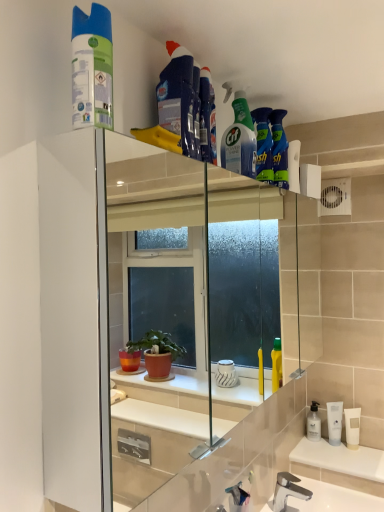
This screenshot has height=512, width=384. In order to click on blue glossy bottle at upper center, the 5th cleaning product when ordered from left to right in this screenshot , I will do tap(263, 145).

Describe the element at coordinates (207, 118) in the screenshot. The image size is (384, 512). I see `blue fabric cleaning product at upper center, which ranks as the third cleaning product in front-to-back order` at that location.

Describe the element at coordinates (288, 490) in the screenshot. The width and height of the screenshot is (384, 512). I see `polished chrome faucet at lower center` at that location.

Locate an element on the screen. polished chrome faucet at lower center is located at coordinates (288, 490).

What is the approximate height of green matte spray bottle at upper center, the 2th cleaning product positioned from the right?

11.73 inches.

Image resolution: width=384 pixels, height=512 pixels. What do you see at coordinates (92, 68) in the screenshot?
I see `green matte spray can at upper left, arranged as the 5th cleaning product when viewed from the right` at bounding box center [92, 68].

Image resolution: width=384 pixels, height=512 pixels. Describe the element at coordinates (177, 96) in the screenshot. I see `blue fabric cleaning product at upper center, which ranks as the 2th cleaning product in front-to-back order` at that location.

Locate an element on the screen. This screenshot has height=512, width=384. blue glossy bottle at upper center, which is the fifth cleaning product from front to back is located at coordinates (263, 145).

Looking at this image, are green matte spray can at upper left, positioned as the 1th cleaning product in front-to-back order, and blue fabric cleaning product at upper center, which ranks as the 2th cleaning product in front-to-back order, far apart?

No, there isn't a large distance between green matte spray can at upper left, positioned as the 1th cleaning product in front-to-back order, and blue fabric cleaning product at upper center, which ranks as the 2th cleaning product in front-to-back order.

Which of these two, green matte spray can at upper left, positioned as the 1th cleaning product in front-to-back order, or blue fabric cleaning product at upper center, which appears as the fourth cleaning product when viewed from the back, is wider?

Wider between the two is blue fabric cleaning product at upper center, which appears as the fourth cleaning product when viewed from the back.

Between green matte spray can at upper left, arranged as the 5th cleaning product when viewed from the right, and blue fabric cleaning product at upper center, marked as the 4th cleaning product in a right-to-left arrangement, which one has less height?

Standing shorter between the two is green matte spray can at upper left, arranged as the 5th cleaning product when viewed from the right.

Which is behind, blue fabric cleaning product at upper center, which appears as the third cleaning product when viewed from the back, or green matte spray bottle at upper center, the 2th cleaning product positioned from the right?

green matte spray bottle at upper center, the 2th cleaning product positioned from the right, is more distant.

Is blue fabric cleaning product at upper center, which is the third cleaning product from left to right, taller than green matte spray bottle at upper center, acting as the fourth cleaning product starting from the front?

No, blue fabric cleaning product at upper center, which is the third cleaning product from left to right, is not taller than green matte spray bottle at upper center, acting as the fourth cleaning product starting from the front.

How many degrees apart are the facing directions of blue fabric cleaning product at upper center, which is counted as the 3th cleaning product, starting from the right, and green matte spray bottle at upper center, positioned as the fourth cleaning product in left-to-right order?

The facing directions of blue fabric cleaning product at upper center, which is counted as the 3th cleaning product, starting from the right, and green matte spray bottle at upper center, positioned as the fourth cleaning product in left-to-right order, are 20.9 degrees apart.

In terms of size, does blue fabric cleaning product at upper center, which appears as the third cleaning product when viewed from the back, appear bigger or smaller than green matte spray bottle at upper center, positioned as the fourth cleaning product in left-to-right order?

In the image, blue fabric cleaning product at upper center, which appears as the third cleaning product when viewed from the back, appears to be smaller than green matte spray bottle at upper center, positioned as the fourth cleaning product in left-to-right order.

I want to click on cleaning product that is the 2nd one when counting leftward from the blue glossy bottle at upper center, which is the fifth cleaning product from front to back, so click(207, 118).

Does blue fabric cleaning product at upper center, which is counted as the 3th cleaning product, starting from the right, turn towards blue glossy bottle at upper center, the first cleaning product positioned from the back?

No, blue fabric cleaning product at upper center, which is counted as the 3th cleaning product, starting from the right, does not turn towards blue glossy bottle at upper center, the first cleaning product positioned from the back.

From the image's perspective, is blue fabric cleaning product at upper center, which is the third cleaning product from left to right, positioned above or below blue glossy bottle at upper center, marked as the first cleaning product in a right-to-left arrangement?

From the image's perspective, blue fabric cleaning product at upper center, which is the third cleaning product from left to right, appears above blue glossy bottle at upper center, marked as the first cleaning product in a right-to-left arrangement.

Which object is wider, blue fabric cleaning product at upper center, which is the third cleaning product from left to right, or blue glossy bottle at upper center, marked as the first cleaning product in a right-to-left arrangement?

blue glossy bottle at upper center, marked as the first cleaning product in a right-to-left arrangement.

Image resolution: width=384 pixels, height=512 pixels. I want to click on tap below the green matte spray can at upper left, arranged as the 5th cleaning product when viewed from the right (from the image's perspective), so click(288, 490).

Does point (79, 9) come closer to viewer compared to point (284, 500)?

Yes, point (79, 9) is in front of point (284, 500).

Is green matte spray can at upper left, marked as the 5th cleaning product in a back-to-front arrangement, in contact with polished chrome faucet at lower center?

No.

Who is smaller, green matte spray can at upper left, placed as the 1th cleaning product when sorted from left to right, or blue fabric cleaning product at upper center, which is counted as the 3th cleaning product, starting from the right?

With smaller size is blue fabric cleaning product at upper center, which is counted as the 3th cleaning product, starting from the right.

Considering the positions of objects green matte spray can at upper left, positioned as the 1th cleaning product in front-to-back order, and blue fabric cleaning product at upper center, which is the third cleaning product from left to right, in the image provided, who is more to the right, green matte spray can at upper left, positioned as the 1th cleaning product in front-to-back order, or blue fabric cleaning product at upper center, which is the third cleaning product from left to right,?

blue fabric cleaning product at upper center, which is the third cleaning product from left to right, is more to the right.

From the image's perspective, who appears lower, green matte spray can at upper left, arranged as the 5th cleaning product when viewed from the right, or blue fabric cleaning product at upper center, which appears as the third cleaning product when viewed from the back?

green matte spray can at upper left, arranged as the 5th cleaning product when viewed from the right, from the image's perspective.

Is point (92, 103) more distant than point (214, 129)?

No, it is not.

Looking at this image, is green matte spray bottle at upper center, acting as the fourth cleaning product starting from the front, positioned far away from blue fabric cleaning product at upper center, which appears as the second cleaning product when viewed from the left?

Actually, green matte spray bottle at upper center, acting as the fourth cleaning product starting from the front, and blue fabric cleaning product at upper center, which appears as the second cleaning product when viewed from the left, are a little close together.

Is green matte spray bottle at upper center, the 2th cleaning product positioned from the right, facing away from blue fabric cleaning product at upper center, marked as the 4th cleaning product in a right-to-left arrangement?

green matte spray bottle at upper center, the 2th cleaning product positioned from the right, is not turned away from blue fabric cleaning product at upper center, marked as the 4th cleaning product in a right-to-left arrangement.

Considering the positions of objects green matte spray bottle at upper center, the 2th cleaning product positioned from the right, and blue fabric cleaning product at upper center, marked as the 4th cleaning product in a right-to-left arrangement, in the image provided, who is more to the left, green matte spray bottle at upper center, the 2th cleaning product positioned from the right, or blue fabric cleaning product at upper center, marked as the 4th cleaning product in a right-to-left arrangement,?

From the viewer's perspective, blue fabric cleaning product at upper center, marked as the 4th cleaning product in a right-to-left arrangement, appears more on the left side.

Considering the sizes of objects green matte spray bottle at upper center, acting as the second cleaning product starting from the back, and blue fabric cleaning product at upper center, which ranks as the 2th cleaning product in front-to-back order, in the image provided, who is shorter, green matte spray bottle at upper center, acting as the second cleaning product starting from the back, or blue fabric cleaning product at upper center, which ranks as the 2th cleaning product in front-to-back order,?

blue fabric cleaning product at upper center, which ranks as the 2th cleaning product in front-to-back order, is shorter.

From a real-world perspective, which object stands above the other?

green matte spray bottle at upper center, acting as the second cleaning product starting from the back.

In the scene shown: From the image's perspective, is blue fabric cleaning product at upper center, which ranks as the 2th cleaning product in front-to-back order, beneath green matte spray bottle at upper center, the 2th cleaning product positioned from the right?

Indeed, from the image's perspective, blue fabric cleaning product at upper center, which ranks as the 2th cleaning product in front-to-back order, is shown beneath green matte spray bottle at upper center, the 2th cleaning product positioned from the right.

Is green matte spray bottle at upper center, acting as the second cleaning product starting from the back, surrounded by blue fabric cleaning product at upper center, which appears as the second cleaning product when viewed from the left?

No, blue fabric cleaning product at upper center, which appears as the second cleaning product when viewed from the left, does not contain green matte spray bottle at upper center, acting as the second cleaning product starting from the back.

The image size is (384, 512). I want to click on the 2nd cleaning product positioned above the green matte spray can at upper left, marked as the 5th cleaning product in a back-to-front arrangement (from a real-world perspective), so click(177, 96).

Locate an element on the screen. Image resolution: width=384 pixels, height=512 pixels. the 1st cleaning product behind the blue fabric cleaning product at upper center, which is counted as the 3th cleaning product, starting from the right is located at coordinates [x=239, y=140].

Considering their positions, is blue glossy bottle at upper center, the 5th cleaning product when ordered from left to right, positioned further to blue fabric cleaning product at upper center, which ranks as the third cleaning product in front-to-back order, than green matte spray can at upper left, positioned as the 1th cleaning product in front-to-back order?

The object further to blue fabric cleaning product at upper center, which ranks as the third cleaning product in front-to-back order, is green matte spray can at upper left, positioned as the 1th cleaning product in front-to-back order.

Looking at this image, which object lies further to the anchor point polished chrome faucet at lower center, blue fabric cleaning product at upper center, which appears as the third cleaning product when viewed from the back, or blue fabric cleaning product at upper center, marked as the 4th cleaning product in a right-to-left arrangement?

blue fabric cleaning product at upper center, marked as the 4th cleaning product in a right-to-left arrangement.

Which object lies further to the anchor point blue glossy bottle at upper center, the 5th cleaning product when ordered from left to right, green matte spray bottle at upper center, positioned as the fourth cleaning product in left-to-right order, or polished chrome faucet at lower center?

Based on the image, polished chrome faucet at lower center appears to be further to blue glossy bottle at upper center, the 5th cleaning product when ordered from left to right.

When comparing their distances from polished chrome faucet at lower center, does blue fabric cleaning product at upper center, which ranks as the third cleaning product in front-to-back order, or green matte spray bottle at upper center, positioned as the fourth cleaning product in left-to-right order, seem closer?

Among the two, green matte spray bottle at upper center, positioned as the fourth cleaning product in left-to-right order, is located nearer to polished chrome faucet at lower center.

Considering their positions, is blue fabric cleaning product at upper center, marked as the 4th cleaning product in a right-to-left arrangement, positioned further to polished chrome faucet at lower center than blue fabric cleaning product at upper center, which appears as the third cleaning product when viewed from the back?

blue fabric cleaning product at upper center, marked as the 4th cleaning product in a right-to-left arrangement.

Based on their spatial positions, is green matte spray can at upper left, arranged as the 5th cleaning product when viewed from the right, or blue fabric cleaning product at upper center, which appears as the fourth cleaning product when viewed from the back, further from blue fabric cleaning product at upper center, which is counted as the 3th cleaning product, starting from the right?

green matte spray can at upper left, arranged as the 5th cleaning product when viewed from the right, is positioned further to the anchor blue fabric cleaning product at upper center, which is counted as the 3th cleaning product, starting from the right.

Based on their spatial positions, is blue fabric cleaning product at upper center, which appears as the third cleaning product when viewed from the back, or polished chrome faucet at lower center further from blue glossy bottle at upper center, which is the fifth cleaning product from front to back?

The object further to blue glossy bottle at upper center, which is the fifth cleaning product from front to back, is polished chrome faucet at lower center.

Looking at the image, which one is located closer to polished chrome faucet at lower center, green matte spray can at upper left, marked as the 5th cleaning product in a back-to-front arrangement, or green matte spray bottle at upper center, the 2th cleaning product positioned from the right?

Based on the image, green matte spray bottle at upper center, the 2th cleaning product positioned from the right, appears to be nearer to polished chrome faucet at lower center.

The image size is (384, 512). Identify the location of cleaning product between blue glossy bottle at upper center, the 5th cleaning product when ordered from left to right, and polished chrome faucet at lower center, in the vertical direction. (92, 68).

Locate an element on the screen. The height and width of the screenshot is (512, 384). cleaning product positioned between blue fabric cleaning product at upper center, which ranks as the third cleaning product in front-to-back order, and blue glossy bottle at upper center, which is the fifth cleaning product from front to back, from near to far is located at coordinates (239, 140).

Find the location of a particular element. The image size is (384, 512). cleaning product between green matte spray can at upper left, marked as the 5th cleaning product in a back-to-front arrangement, and blue fabric cleaning product at upper center, which ranks as the third cleaning product in front-to-back order, along the z-axis is located at coordinates (177, 96).

Identify the location of cleaning product between blue fabric cleaning product at upper center, which ranks as the 2th cleaning product in front-to-back order, and green matte spray bottle at upper center, the 2th cleaning product positioned from the right, in the front-back direction. The height and width of the screenshot is (512, 384). (207, 118).